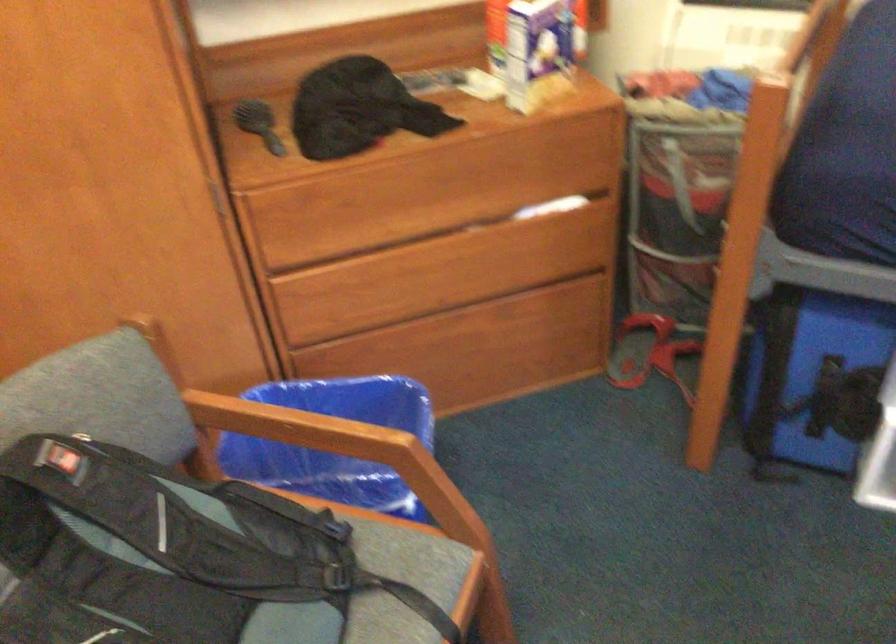
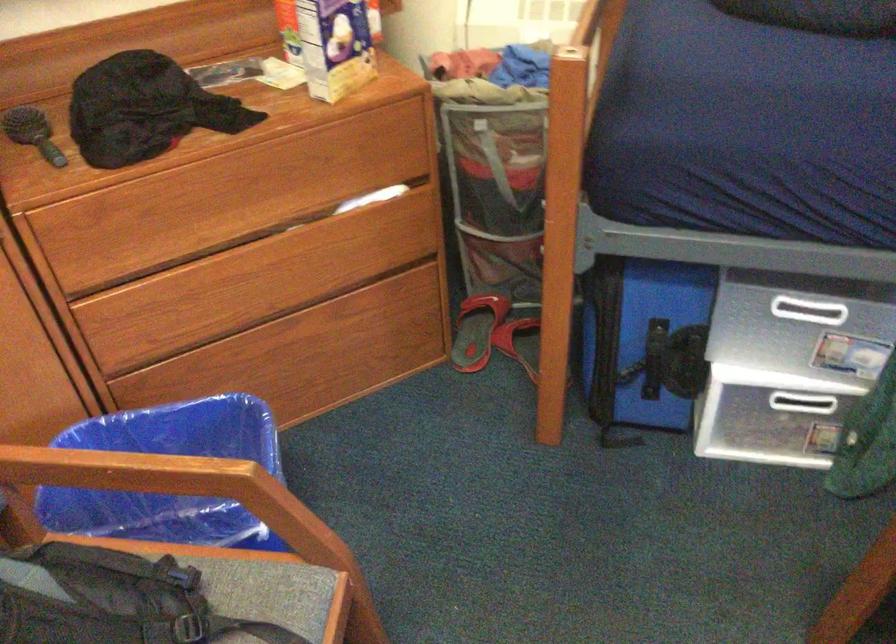
Question: The images are taken continuously from a first-person perspective. In which direction are you moving?

Choices:
 (A) Left
 (B) Right
 (C) Forward
 (D) Backward

Answer: (C)